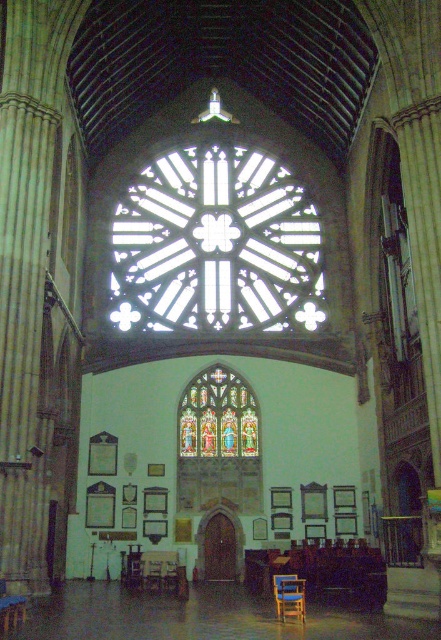
Question: Among these objects, which one is nearest to the camera?

Choices:
 (A) wooden chair at lower center
 (B) stained glass window at center
 (C) clear glass rose window at center

Answer: (A)

Question: Which object appears closest to the camera in this image?

Choices:
 (A) clear glass rose window at center
 (B) wooden chair at lower center
 (C) stained glass window at center

Answer: (B)

Question: Is stained glass window at center behind wooden chair at lower center?

Choices:
 (A) no
 (B) yes

Answer: (B)

Question: Can you confirm if stained glass window at center is positioned above wooden chair at lower center?

Choices:
 (A) no
 (B) yes

Answer: (B)

Question: Is clear glass rose window at center positioned at the back of wooden chair at lower center?

Choices:
 (A) yes
 (B) no

Answer: (A)

Question: Which object appears closest to the camera in this image?

Choices:
 (A) clear glass rose window at center
 (B) stained glass window at center

Answer: (B)